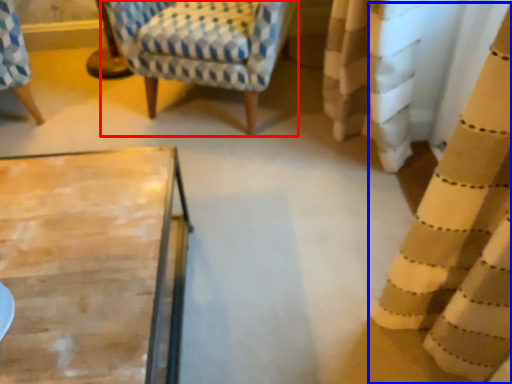
Question: Among these objects, which one is farthest to the camera, rocking chair (highlighted by a red box) or curtain (highlighted by a blue box)?

Choices:
 (A) rocking chair
 (B) curtain

Answer: (A)